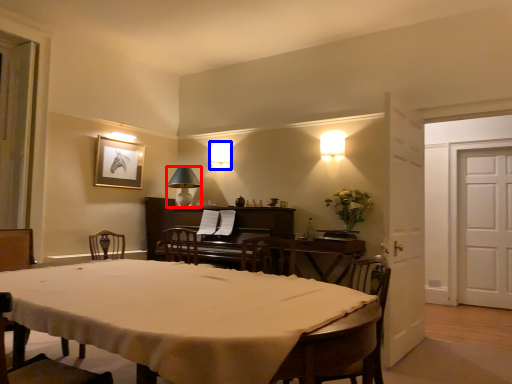
Question: Which object appears farthest to the camera in this image, lamp (highlighted by a red box) or lamp (highlighted by a blue box)?

Choices:
 (A) lamp
 (B) lamp

Answer: (B)